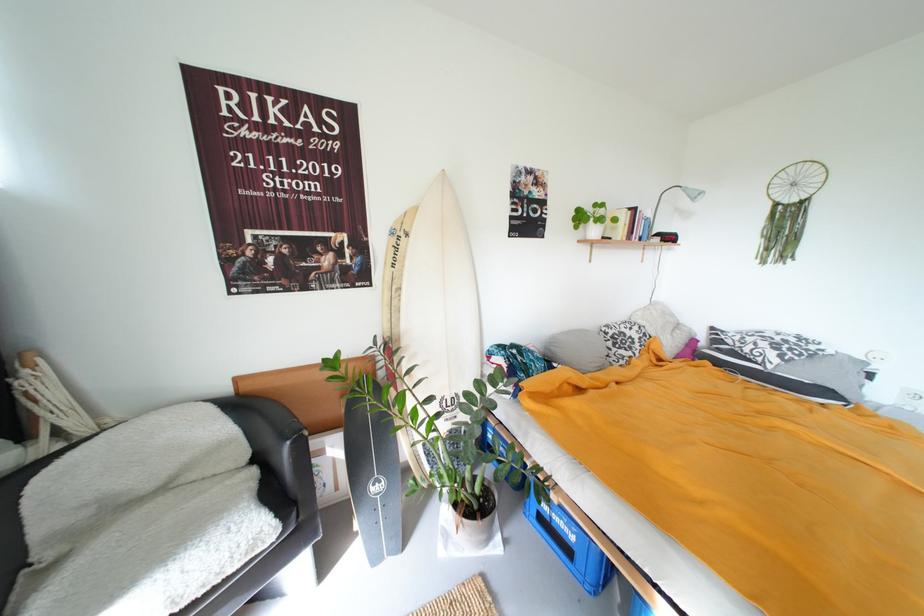
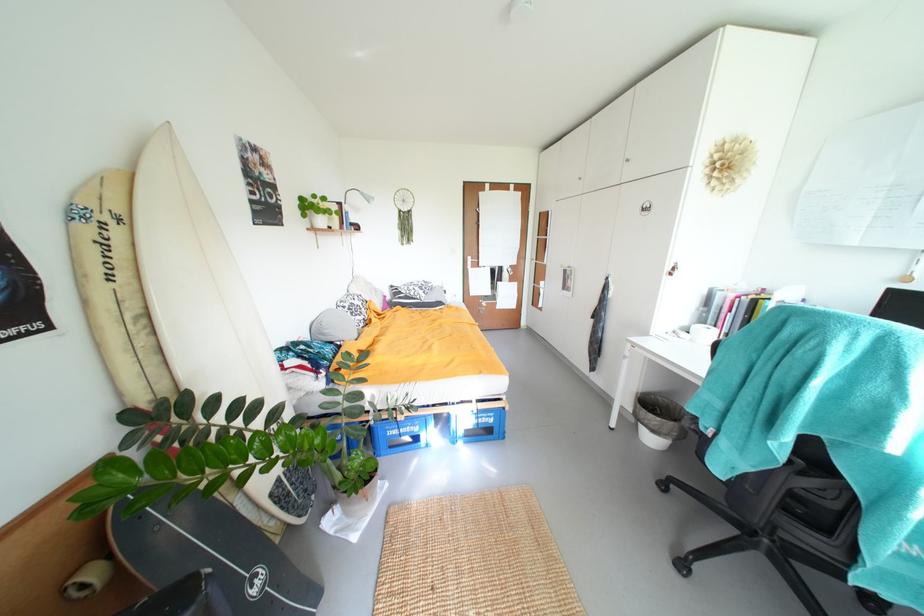
Question: How did the camera likely rotate?

Choices:
 (A) Left
 (B) Right
 (C) Up
 (D) Down

Answer: (B)